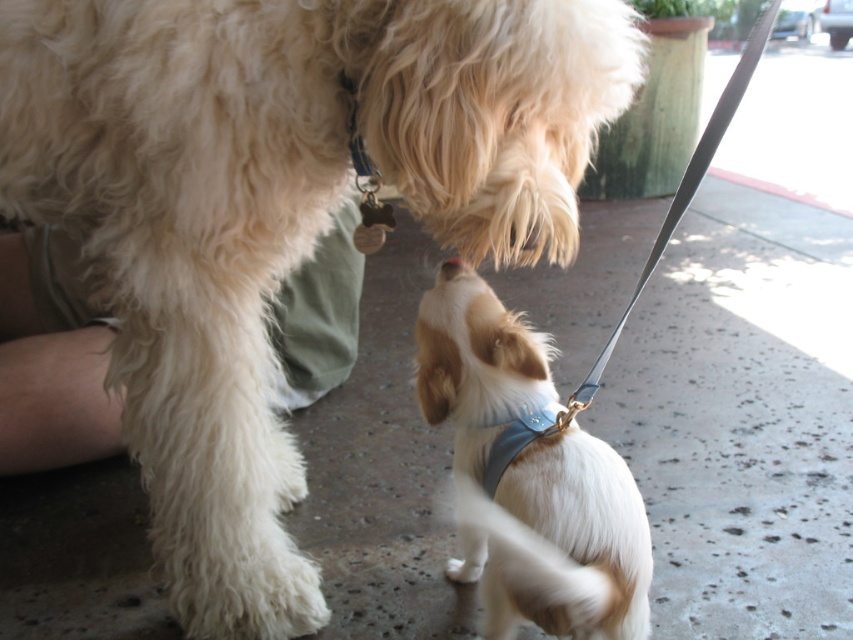
Question: Does smooth gray leash at center appear on the left side of blue fabric neckband at lower center?

Choices:
 (A) no
 (B) yes

Answer: (A)

Question: Is smooth gray leash at center above blue fabric neckband at lower center?

Choices:
 (A) no
 (B) yes

Answer: (B)

Question: Estimate the real-world distances between objects in this image. Which object is farther from the white soft fur dog at center?

Choices:
 (A) smooth gray leash at center
 (B) blue fabric neckband at lower center

Answer: (A)

Question: Is smooth gray leash at center bigger than blue fabric neckband at lower center?

Choices:
 (A) no
 (B) yes

Answer: (B)

Question: Which point is closer to the camera?

Choices:
 (A) (509, 420)
 (B) (601, 484)

Answer: (B)

Question: Which object is closer to the camera taking this photo?

Choices:
 (A) smooth gray leash at center
 (B) white soft fur dog at center

Answer: (B)